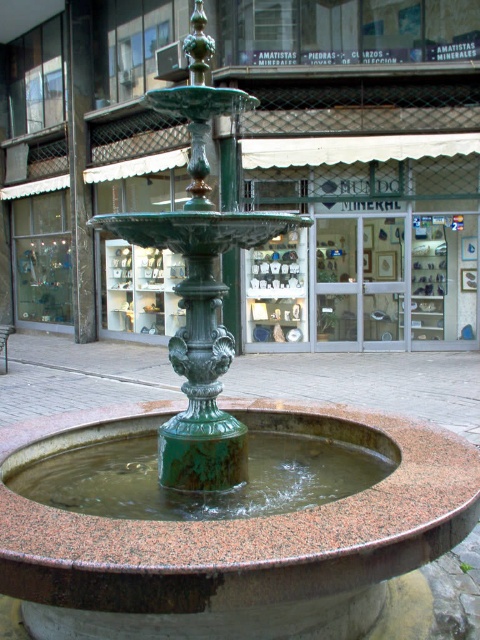
In the scene shown: You are standing in the public square and want to locate the green glazed fountain at center. According to the coordinates provided, where should you look?

The green glazed fountain at center is located at coordinates point (248, 547).

You are standing in front of the fountain and want to know how far you are from the point marked at coordinates point (x=21, y=598). Can you determine the distance?

The distance of point (x=21, y=598) from viewer is 7.43 feet.

You are standing in the public square and see the green glazed fountain at center and the green patina fountain at center. Which one is positioned lower in the image?

The green glazed fountain at center is positioned lower than the green patina fountain at center according to the description.